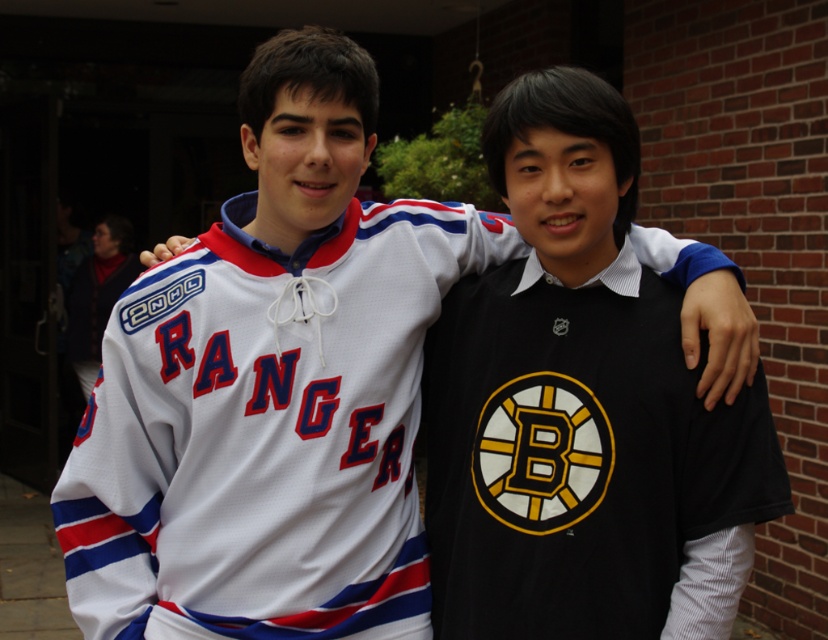
Can you confirm if black jersey at center is thinner than white jersey at center?

In fact, black jersey at center might be wider than white jersey at center.

Measure the distance between black jersey at center and white jersey at center.

black jersey at center and white jersey at center are 5.88 meters apart from each other.

Is point (437, 394) more distant than point (95, 369)?

No, it is in front of (95, 369).

This screenshot has width=828, height=640. What are the coordinates of `black jersey at center` in the screenshot? It's located at (583, 460).